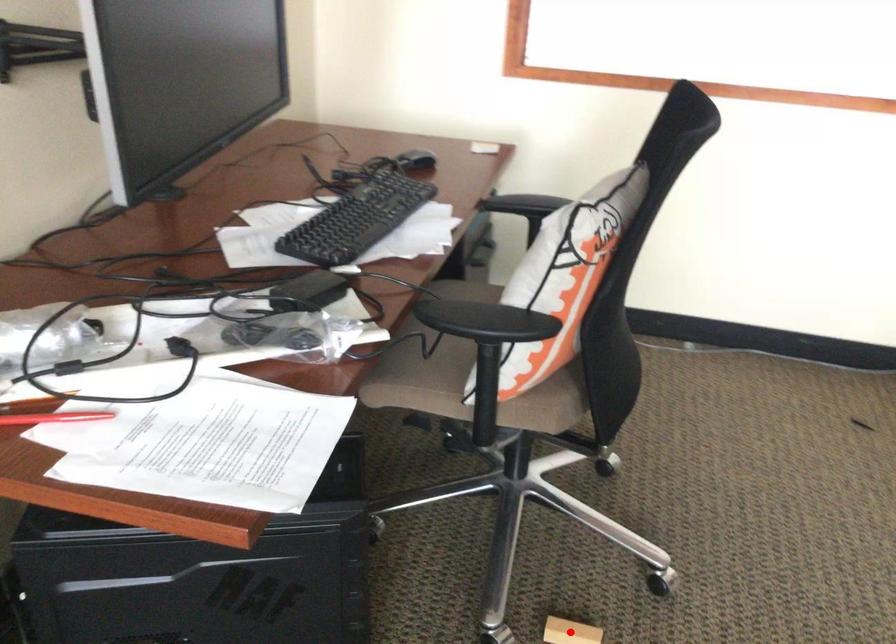
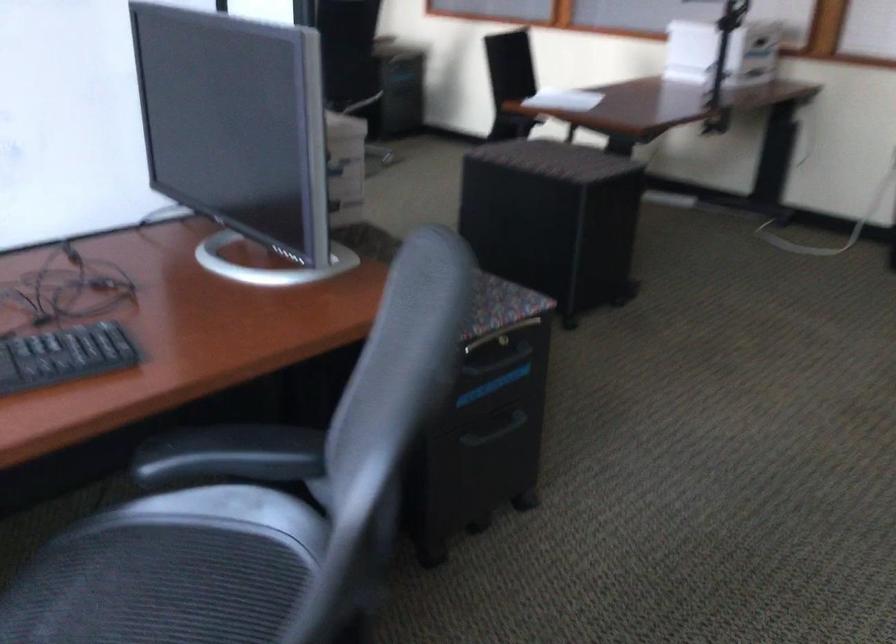
Question: I am providing you with two images of the same scene from different viewpoints. A red point is marked on the first image. Is the red point's position out of view in image 2?

Choices:
 (A) Yes
 (B) No

Answer: (A)